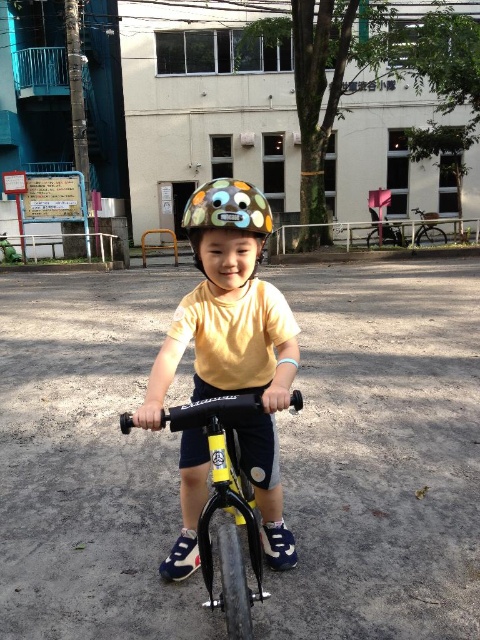
Question: Which object is farther from the camera taking this photo?

Choices:
 (A) metallic silver bicycle at right
 (B) matte colorful helmet at center

Answer: (A)

Question: Which object appears closest to the camera in this image?

Choices:
 (A) matte colorful helmet at center
 (B) yellow matte helmet at center
 (C) black matte bicycle at center
 (D) metallic silver bicycle at right

Answer: (C)

Question: Which of these objects is positioned closest to the yellow matte helmet at center?

Choices:
 (A) metallic silver bicycle at right
 (B) matte colorful helmet at center
 (C) black matte bicycle at center

Answer: (C)

Question: Does yellow matte helmet at center have a greater width compared to matte colorful helmet at center?

Choices:
 (A) yes
 (B) no

Answer: (B)

Question: Does yellow matte helmet at center have a smaller size compared to matte colorful helmet at center?

Choices:
 (A) yes
 (B) no

Answer: (A)

Question: Does yellow matte helmet at center appear under matte colorful helmet at center?

Choices:
 (A) yes
 (B) no

Answer: (A)